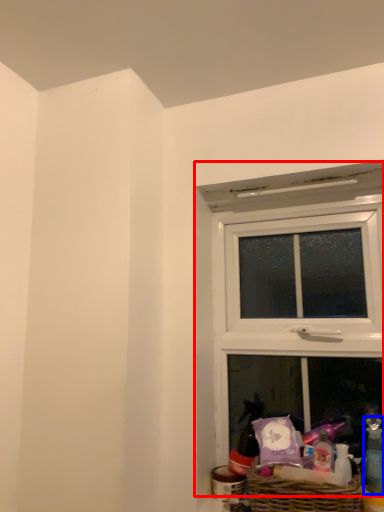
Question: Which of the following is the closest to the observer, window (highlighted by a red box) or toiletry (highlighted by a blue box)?

Choices:
 (A) window
 (B) toiletry

Answer: (B)